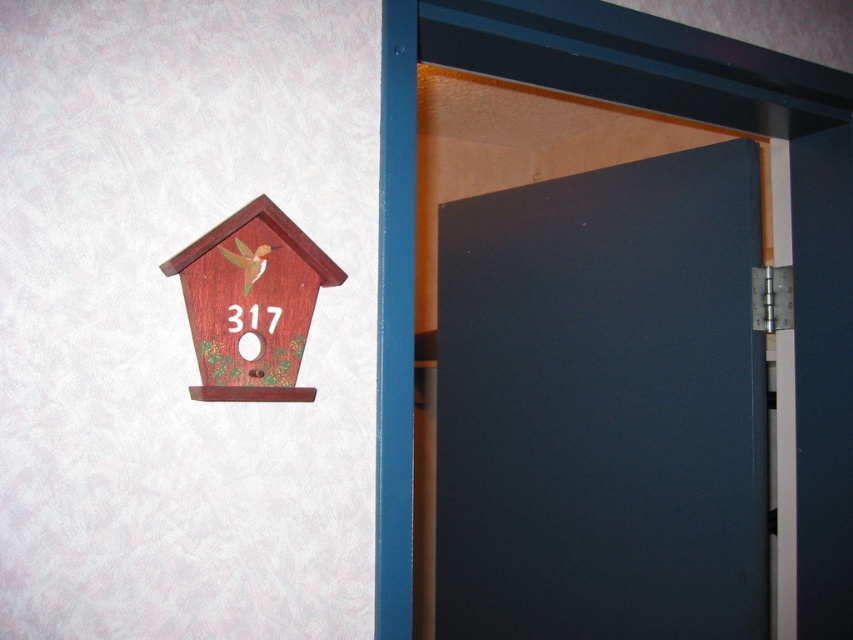
You are a delivery person holding a 40 inch wide package. You need to carry it through the dark blue matte door at center. Can you fit the package through the doorway without tilting it? Mention the wooden birdhouse at left in your answer.

The distance between the dark blue matte door at center and wooden birdhouse at left is 38.08 inches. Since the package is 40 inches wide, it is wider than the available space between the door and the birdhouse. Therefore, the package cannot fit through without tilting it.

You are standing in front of the wall and want to place a sticker exactly at the center of the wooden birdhouse at left. According to the coordinates provided, where should you place the sticker?

The sticker should be placed at the center of the wooden birdhouse at left, which is located at the coordinates (x=251, y=301).